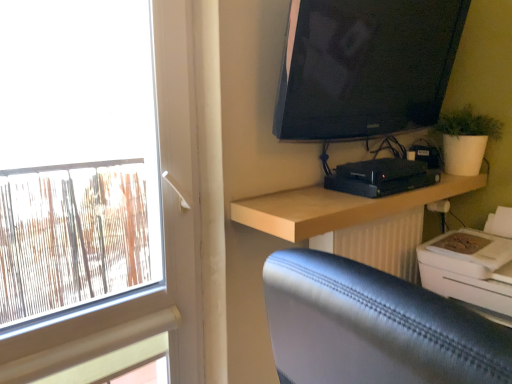
Question: From the image's perspective, is light wood shelf at upper right on white plastic printer at lower right?

Choices:
 (A) yes
 (B) no

Answer: (A)

Question: Is light wood shelf at upper right oriented towards white plastic printer at lower right?

Choices:
 (A) no
 (B) yes

Answer: (A)

Question: From the image's perspective, is light wood shelf at upper right located beneath white plastic printer at lower right?

Choices:
 (A) yes
 (B) no

Answer: (B)

Question: Is light wood shelf at upper right looking in the opposite direction of white plastic printer at lower right?

Choices:
 (A) no
 (B) yes

Answer: (A)

Question: Considering the relative positions of light wood shelf at upper right and white plastic printer at lower right in the image provided, is light wood shelf at upper right to the right of white plastic printer at lower right from the viewer's perspective?

Choices:
 (A) yes
 (B) no

Answer: (B)

Question: From a real-world perspective, is white plastic printer at lower right above or below black glossy tv at upper right?

Choices:
 (A) above
 (B) below

Answer: (B)

Question: Based on their sizes in the image, would you say white plastic printer at lower right is bigger or smaller than black glossy tv at upper right?

Choices:
 (A) big
 (B) small

Answer: (B)

Question: From the image's perspective, relative to black glossy tv at upper right, is white plastic printer at lower right above or below?

Choices:
 (A) above
 (B) below

Answer: (B)

Question: Would you say white plastic printer at lower right is to the left or to the right of black glossy tv at upper right in the picture?

Choices:
 (A) right
 (B) left

Answer: (A)

Question: Is black glossy tv at upper right in front of or behind light wood shelf at upper right in the image?

Choices:
 (A) behind
 (B) front

Answer: (B)

Question: In terms of size, does black glossy tv at upper right appear bigger or smaller than light wood shelf at upper right?

Choices:
 (A) big
 (B) small

Answer: (A)

Question: From a real-world perspective, is black glossy tv at upper right positioned above or below light wood shelf at upper right?

Choices:
 (A) below
 (B) above

Answer: (B)

Question: Considering the positions of point (287, 132) and point (259, 201), is point (287, 132) closer or farther from the camera than point (259, 201)?

Choices:
 (A) closer
 (B) farther

Answer: (A)

Question: From a real-world perspective, relative to white plastic printer at lower right, is light wood shelf at upper right vertically above or below?

Choices:
 (A) below
 (B) above

Answer: (B)

Question: Considering the positions of point (340, 200) and point (458, 236), is point (340, 200) closer or farther from the camera than point (458, 236)?

Choices:
 (A) farther
 (B) closer

Answer: (B)